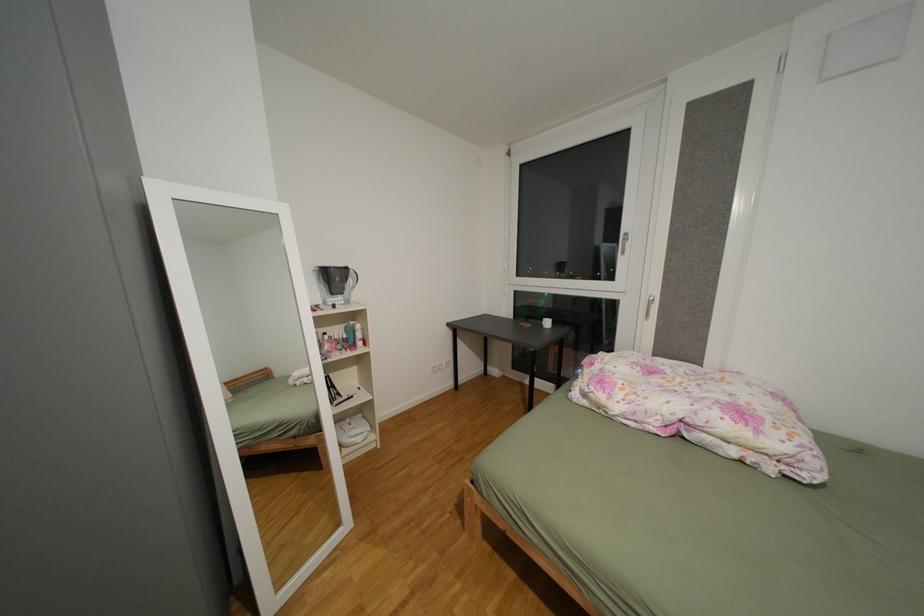
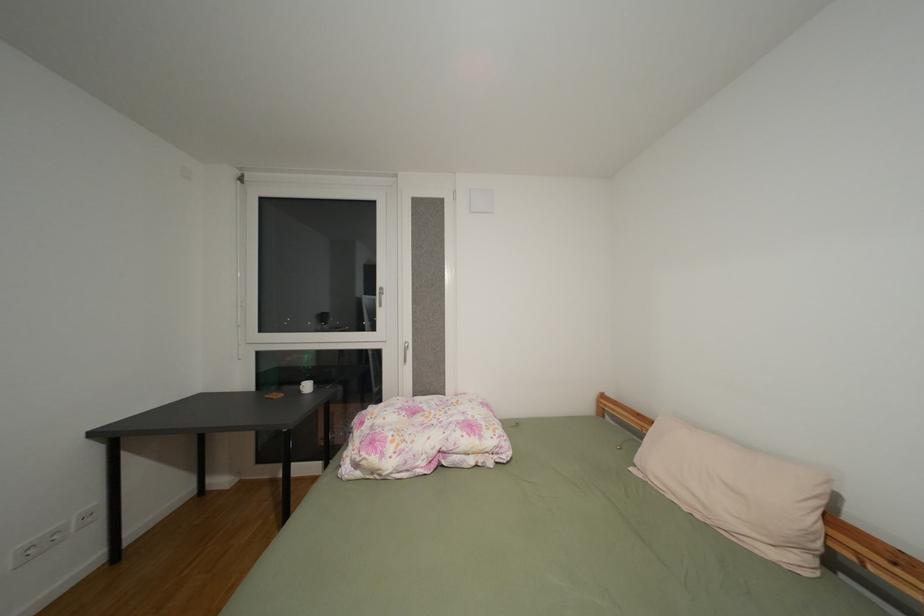
Question: The camera is either moving clockwise (left) or counter-clockwise (right) around the object. The first image is from the beginning of the video and the second image is from the end. Is the camera moving left or right when shooting the video?

Choices:
 (A) Left
 (B) Right

Answer: (A)